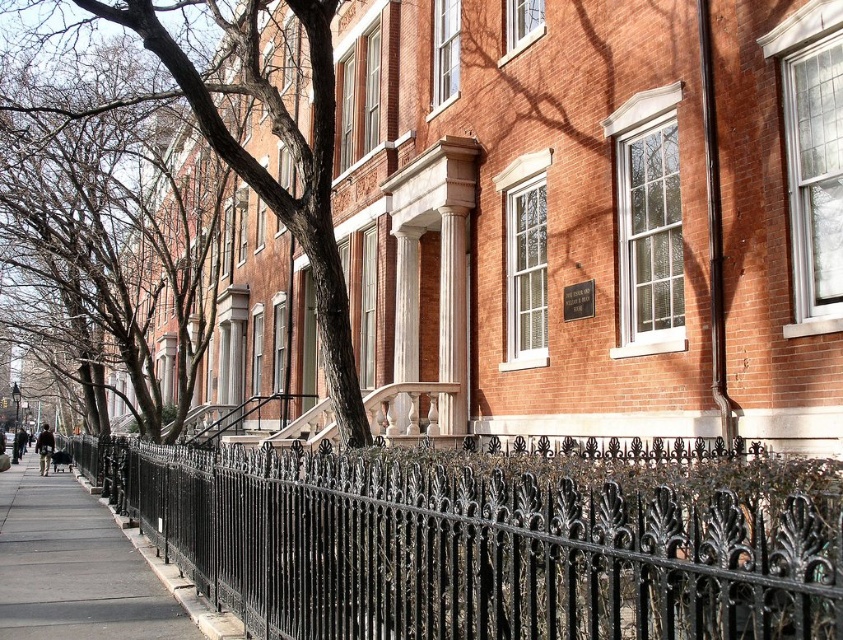
Question: Is black wrought iron fence at lower center below brown bark tree at center?

Choices:
 (A) no
 (B) yes

Answer: (B)

Question: Among these points, which one is farthest from the camera?

Choices:
 (A) click(148, 602)
 (B) click(261, 86)

Answer: (B)

Question: Is black wrought iron fence at lower center thinner than brown bark tree at center?

Choices:
 (A) yes
 (B) no

Answer: (A)

Question: Is black wrought iron fence at lower center wider than brown bark tree at center?

Choices:
 (A) no
 (B) yes

Answer: (A)

Question: Which object appears closest to the camera in this image?

Choices:
 (A) brown bark tree at center
 (B) black wrought iron fence at lower center
 (C) gray concrete sidewalk at lower left

Answer: (B)

Question: Among these objects, which one is farthest from the camera?

Choices:
 (A) black wrought iron fence at lower center
 (B) brown bark tree at center

Answer: (B)